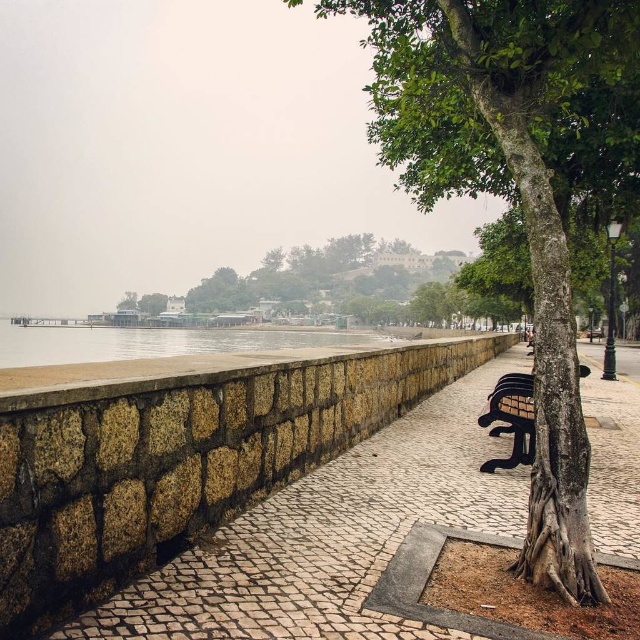
Question: Can you confirm if clear water at lower center is positioned above metallic silver bench at right?

Choices:
 (A) no
 (B) yes

Answer: (B)

Question: Can you confirm if green rough bark tree at center is positioned above metallic silver bench at right?

Choices:
 (A) yes
 (B) no

Answer: (A)

Question: Estimate the real-world distances between objects in this image. Which object is closer to the green rough bark tree at center?

Choices:
 (A) clear water at lower center
 (B) metallic silver bench at right
 (C) brown cobblestone pavement at center-left

Answer: (C)

Question: Which object is positioned closest to the brown cobblestone pavement at center-left?

Choices:
 (A) clear water at lower center
 (B) green rough bark tree at center
 (C) metallic silver bench at right

Answer: (C)

Question: Does brown cobblestone pavement at center-left have a lesser width compared to green rough bark tree at center?

Choices:
 (A) yes
 (B) no

Answer: (B)

Question: Which point is closer to the camera?

Choices:
 (A) (145, 337)
 (B) (545, 468)
 (C) (305, 634)
 (D) (477, 422)

Answer: (C)